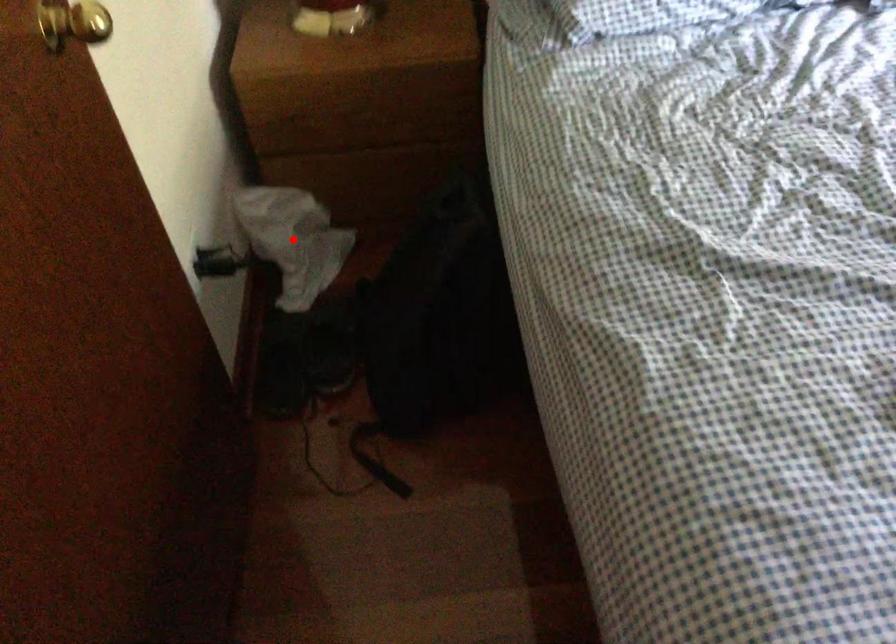
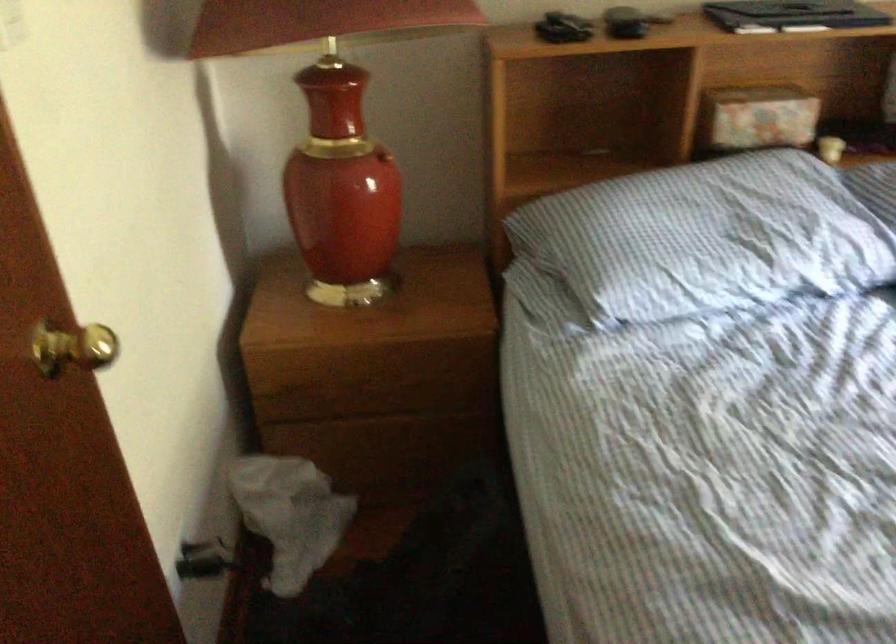
Question: I am providing you with two images of the same scene from different viewpoints. A red point is marked on the first image. Can you still see the location of the red point in image 2?

Choices:
 (A) Yes
 (B) No

Answer: (A)